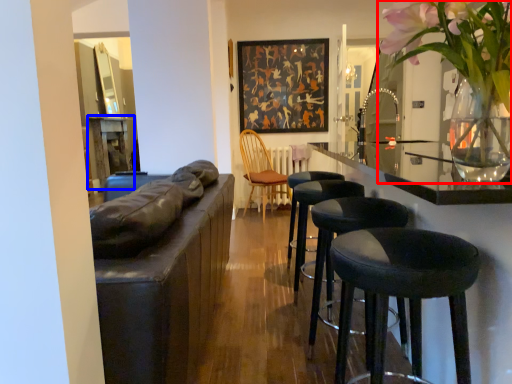
Question: Which object is closer to the camera taking this photo, floral arrangement (highlighted by a red box) or table (highlighted by a blue box)?

Choices:
 (A) floral arrangement
 (B) table

Answer: (A)